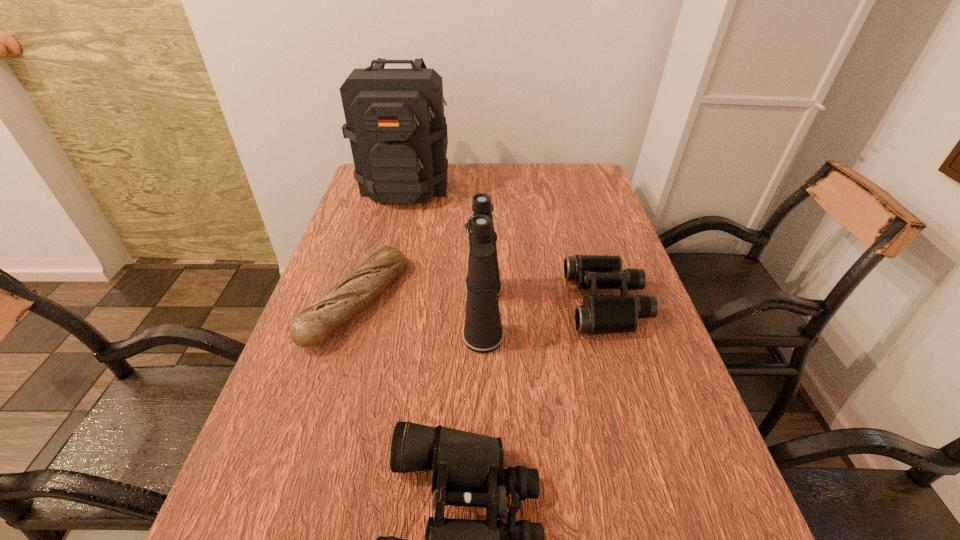
This screenshot has width=960, height=540. I want to click on the tallest object, so click(x=395, y=122).

Where is `the farthest object`? The width and height of the screenshot is (960, 540). the farthest object is located at coordinates (395, 122).

Locate an element on the screen. The height and width of the screenshot is (540, 960). the tallest binoculars is located at coordinates (482, 333).

The image size is (960, 540). Find the location of `the rightmost object`. the rightmost object is located at coordinates (599, 314).

Find the location of a particular element. This screenshot has height=540, width=960. baguet is located at coordinates (350, 295).

I want to click on vacant space located on the front compartment of the backpack, so click(x=395, y=234).

The width and height of the screenshot is (960, 540). In order to click on vacant area situated 0.120m on the right of the fourth shortest object in this screenshot , I will do `click(553, 314)`.

The width and height of the screenshot is (960, 540). I want to click on vacant space located 0.260m on the front-facing side of the rightmost object, so click(x=464, y=302).

Find the location of `vacant position located 0.280m on the front-facing side of the rightmost object`. vacant position located 0.280m on the front-facing side of the rightmost object is located at coordinates (455, 302).

Image resolution: width=960 pixels, height=540 pixels. I want to click on free space located 0.230m on the front-facing side of the rightmost object, so click(475, 302).